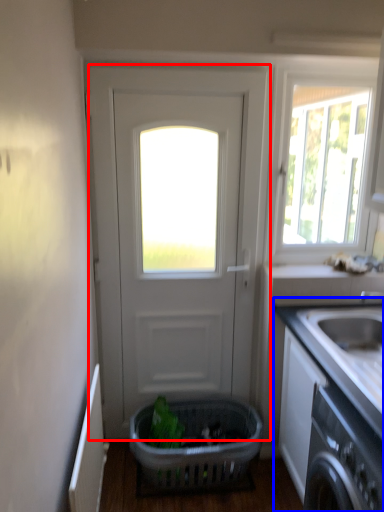
Question: Which of the following is the farthest to the observer, door (highlighted by a red box) or countertop (highlighted by a blue box)?

Choices:
 (A) door
 (B) countertop

Answer: (A)